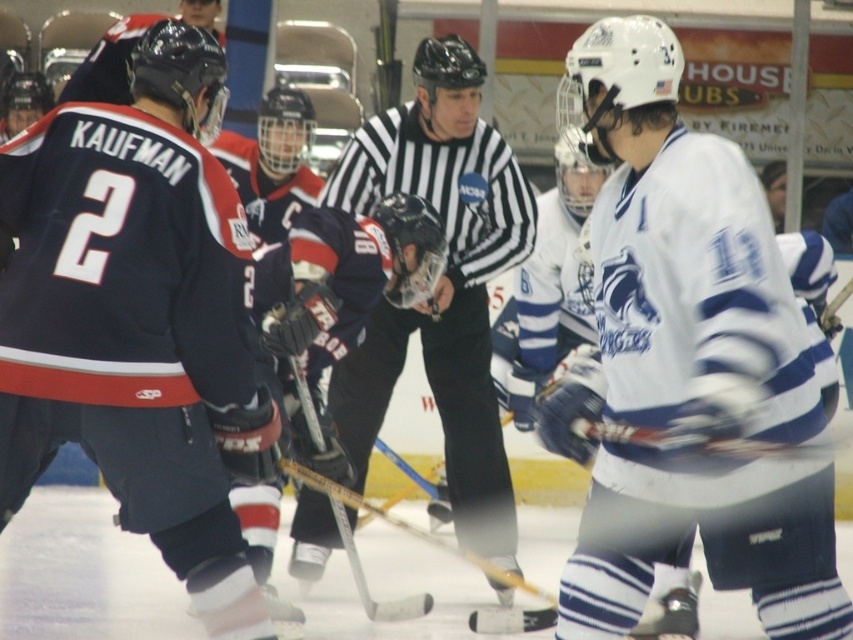
Question: Which of the following is the closest to the observer?

Choices:
 (A) wooden hockey stick at center
 (B) black and white striped shirt at center

Answer: (A)

Question: Where is black and white striped shirt at center located in relation to wooden hockey stick at center in the image?

Choices:
 (A) left
 (B) right

Answer: (B)

Question: Which of the following is the closest to the observer?

Choices:
 (A) (376, 413)
 (B) (349, 544)

Answer: (B)

Question: Is black and white striped shirt at center below wooden hockey stick at center?

Choices:
 (A) yes
 (B) no

Answer: (B)

Question: Which object appears farthest from the camera in this image?

Choices:
 (A) black and white striped shirt at center
 (B) wooden hockey stick at center

Answer: (A)

Question: Is black and white striped shirt at center wider than wooden hockey stick at center?

Choices:
 (A) yes
 (B) no

Answer: (A)